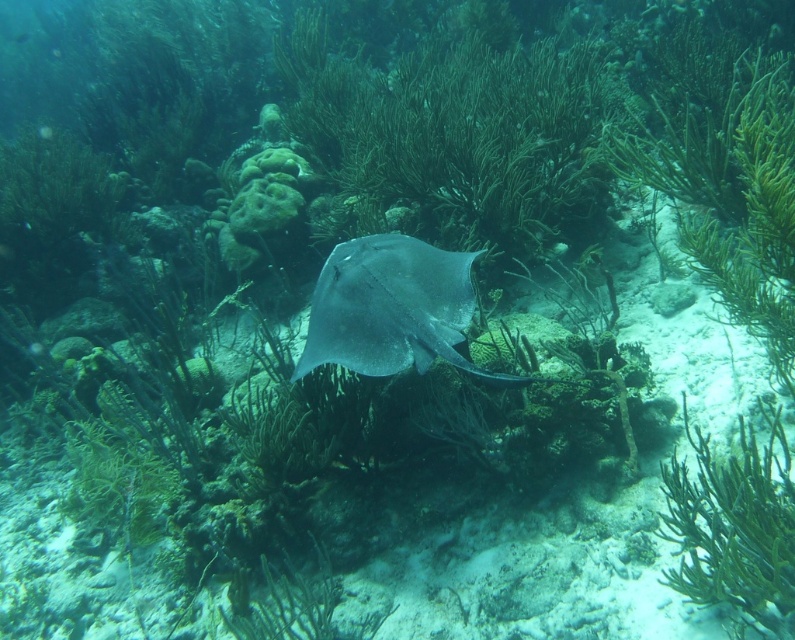
Is green soft coral at center to the right of smooth gray stingray at center from the viewer's perspective?

Yes, green soft coral at center is to the right of smooth gray stingray at center.

Does green soft coral at center have a smaller size compared to smooth gray stingray at center?

Yes.

I want to click on green soft coral at center, so (x=735, y=529).

Is green matte algae at center bigger than green soft coral at center?

Indeed, green matte algae at center has a larger size compared to green soft coral at center.

Who is positioned more to the right, green matte algae at center or green soft coral at center?

green soft coral at center

The image size is (795, 640). What do you see at coordinates (452, 136) in the screenshot?
I see `green matte algae at center` at bounding box center [452, 136].

Where is `green matte algae at center`? Image resolution: width=795 pixels, height=640 pixels. green matte algae at center is located at coordinates (452, 136).

From the picture: Is green matte algae at center bigger than smooth gray stingray at center?

Yes.

Which is in front, point (501, 125) or point (301, 362)?

Point (301, 362) is more forward.

Is point (431, 115) positioned in front of point (312, 353)?

That is False.

Locate an element on the screen. green matte algae at center is located at coordinates (452, 136).